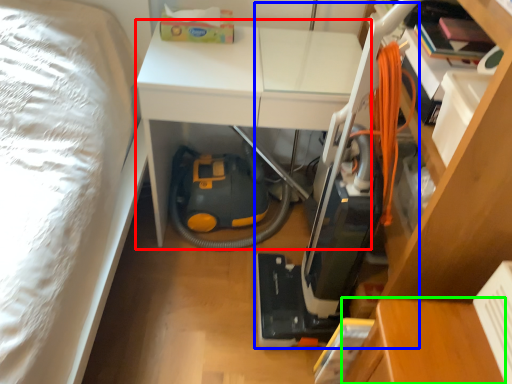
Question: Which is nearer to the table (highlighted by a red box)? vacuum (highlighted by a blue box) or table (highlighted by a green box).

Choices:
 (A) vacuum
 (B) table

Answer: (A)